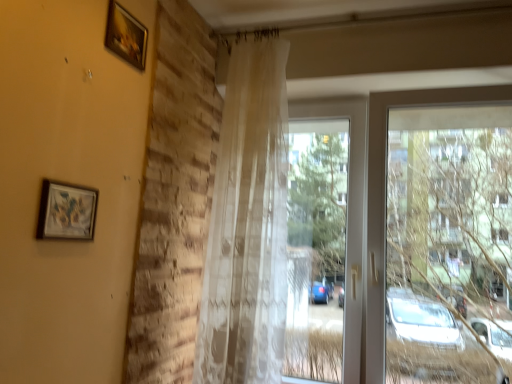
Question: Can you confirm if transparent fabric curtain at center is smaller than matte wooden picture frame at upper left, which appears as the 2th picture frame when viewed from the top?

Choices:
 (A) yes
 (B) no

Answer: (B)

Question: Is transparent fabric curtain at center oriented away from matte wooden picture frame at upper left, marked as the first picture frame in a bottom-to-top arrangement?

Choices:
 (A) no
 (B) yes

Answer: (A)

Question: Would you say transparent fabric curtain at center is outside matte wooden picture frame at upper left, which appears as the 2th picture frame when viewed from the top?

Choices:
 (A) yes
 (B) no

Answer: (A)

Question: Is transparent fabric curtain at center shorter than matte wooden picture frame at upper left, marked as the first picture frame in a bottom-to-top arrangement?

Choices:
 (A) yes
 (B) no

Answer: (B)

Question: From the image's perspective, is transparent fabric curtain at center located beneath matte wooden picture frame at upper left, marked as the first picture frame in a bottom-to-top arrangement?

Choices:
 (A) no
 (B) yes

Answer: (B)

Question: Considering the relative positions of transparent fabric curtain at center and matte wooden picture frame at upper left, which is the first picture frame from left to right, in the image provided, is transparent fabric curtain at center to the right of matte wooden picture frame at upper left, which is the first picture frame from left to right, from the viewer's perspective?

Choices:
 (A) yes
 (B) no

Answer: (A)

Question: From a real-world perspective, is wooden frame at upper left, the first picture frame from the back, below translucent beige curtain at center?

Choices:
 (A) yes
 (B) no

Answer: (B)

Question: Is wooden frame at upper left, which appears as the 1th picture frame when viewed from the top, closer to camera compared to translucent beige curtain at center?

Choices:
 (A) yes
 (B) no

Answer: (A)

Question: Is wooden frame at upper left, positioned as the 2th picture frame in left-to-right order, wider than translucent beige curtain at center?

Choices:
 (A) yes
 (B) no

Answer: (B)

Question: From the image's perspective, is wooden frame at upper left, the second picture frame ordered from the bottom, above translucent beige curtain at center?

Choices:
 (A) yes
 (B) no

Answer: (A)

Question: Does wooden frame at upper left, the 1th picture frame when ordered from right to left, have a smaller size compared to translucent beige curtain at center?

Choices:
 (A) yes
 (B) no

Answer: (A)

Question: Considering the relative sizes of wooden frame at upper left, the first picture frame from the back, and translucent beige curtain at center in the image provided, is wooden frame at upper left, the first picture frame from the back, bigger than translucent beige curtain at center?

Choices:
 (A) yes
 (B) no

Answer: (B)

Question: Considering the relative positions of matte wooden picture frame at upper left, which is the first picture frame from left to right, and transparent fabric curtain at center in the image provided, is matte wooden picture frame at upper left, which is the first picture frame from left to right, to the left of transparent fabric curtain at center from the viewer's perspective?

Choices:
 (A) no
 (B) yes

Answer: (B)